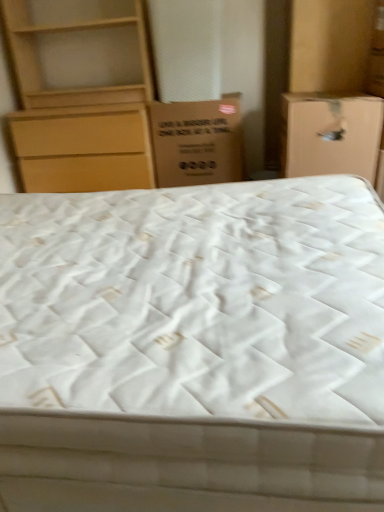
Question: From their relative heights in the image, would you say matte wood chest of drawers at upper left is taller or shorter than matte cardboard box at right, the 1th cardboard box viewed from the right?

Choices:
 (A) short
 (B) tall

Answer: (B)

Question: Is matte wood chest of drawers at upper left wider or thinner than matte cardboard box at right, the 1th cardboard box viewed from the right?

Choices:
 (A) wide
 (B) thin

Answer: (A)

Question: Which object is the farthest from the white quilted mattress at center?

Choices:
 (A) brown cardboard box at center, which appears as the 1th cardboard box when viewed from the left
 (B) matte wood chest of drawers at upper left
 (C) matte cardboard box at right, which is the second cardboard box in left-to-right order

Answer: (B)

Question: Estimate the real-world distances between objects in this image. Which object is farther from the matte wood chest of drawers at upper left?

Choices:
 (A) matte cardboard box at right, the 1th cardboard box viewed from the right
 (B) white quilted mattress at center
 (C) brown cardboard box at center, which appears as the 1th cardboard box when viewed from the left

Answer: (B)